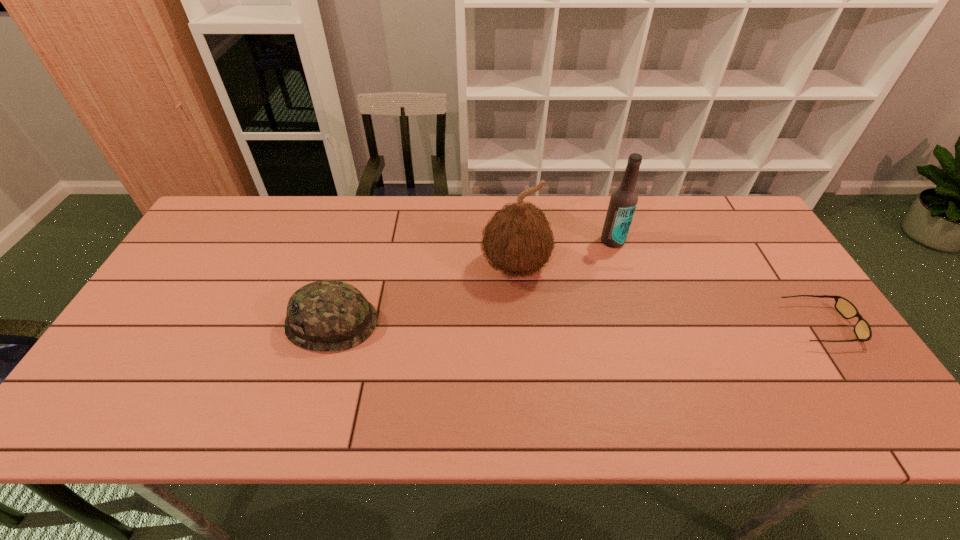
You are a GUI agent. You are given a task and a screenshot of the screen. Output one action in this format:
    pyautogui.click(x=<x>, y=<y>)
    Task: Click on the free space on the desktop that is between the headwear and the shortest object and is positioned on the side of the third object from left to right with the label
    
    Given the screenshot: What is the action you would take?
    pyautogui.click(x=568, y=323)

This screenshot has height=540, width=960. In order to click on vacant space on the desktop that is between the headwear and the sunglasses and is positioned on the surface of the coconut in this screenshot , I will do `click(518, 323)`.